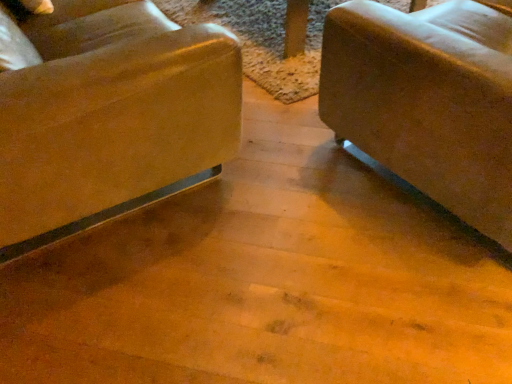
Question: Considering the relative sizes of matte brown chair at left and suede-like beige couch at right in the image provided, is matte brown chair at left bigger than suede-like beige couch at right?

Choices:
 (A) yes
 (B) no

Answer: (A)

Question: Considering the relative sizes of matte brown chair at left and suede-like beige couch at right in the image provided, is matte brown chair at left wider than suede-like beige couch at right?

Choices:
 (A) yes
 (B) no

Answer: (B)

Question: Is matte brown chair at left to the right of suede-like beige couch at right from the viewer's perspective?

Choices:
 (A) no
 (B) yes

Answer: (A)

Question: Is matte brown chair at left oriented away from suede-like beige couch at right?

Choices:
 (A) no
 (B) yes

Answer: (A)

Question: Is matte brown chair at left smaller than suede-like beige couch at right?

Choices:
 (A) yes
 (B) no

Answer: (B)

Question: Is matte brown chair at left positioned far away from suede-like beige couch at right?

Choices:
 (A) yes
 (B) no

Answer: (B)

Question: Considering the relative positions of suede-like beige couch at right and matte brown chair at left in the image provided, is suede-like beige couch at right to the right of matte brown chair at left from the viewer's perspective?

Choices:
 (A) yes
 (B) no

Answer: (A)

Question: Is suede-like beige couch at right smaller than matte brown chair at left?

Choices:
 (A) yes
 (B) no

Answer: (A)

Question: From the image's perspective, is suede-like beige couch at right located above matte brown chair at left?

Choices:
 (A) no
 (B) yes

Answer: (A)

Question: Can you confirm if suede-like beige couch at right is shorter than matte brown chair at left?

Choices:
 (A) no
 (B) yes

Answer: (B)

Question: Considering the relative positions of suede-like beige couch at right and matte brown chair at left in the image provided, is suede-like beige couch at right to the left of matte brown chair at left from the viewer's perspective?

Choices:
 (A) no
 (B) yes

Answer: (A)

Question: Is suede-like beige couch at right positioned in front of matte brown chair at left?

Choices:
 (A) yes
 (B) no

Answer: (B)

Question: Is suede-like beige couch at right situated inside matte brown chair at left or outside?

Choices:
 (A) inside
 (B) outside

Answer: (B)